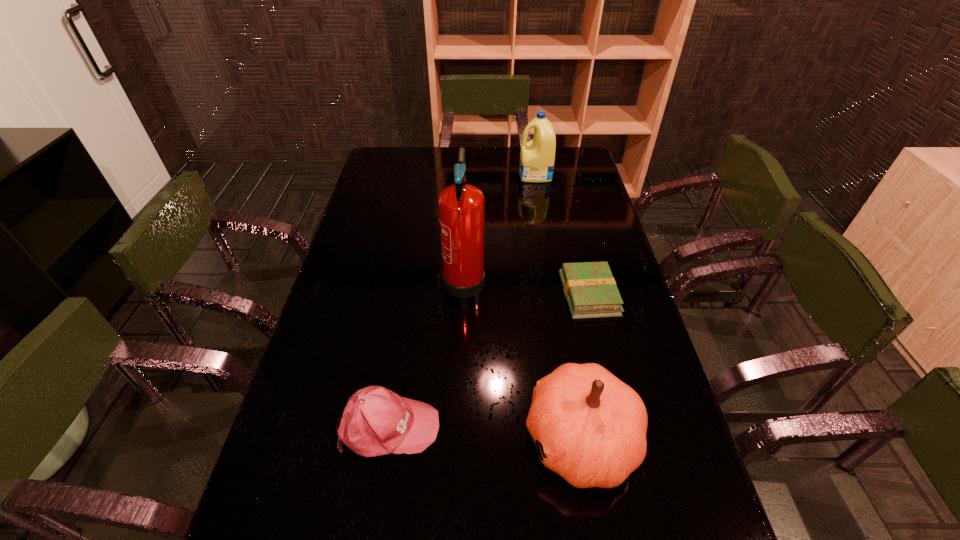
Where is `vacant space at the right edge of the desktop`? This screenshot has width=960, height=540. vacant space at the right edge of the desktop is located at coordinates pyautogui.click(x=605, y=235).

The image size is (960, 540). I want to click on free location at the far left corner of the desktop, so click(382, 151).

Identify the location of vacant space at the far right corner. (558, 160).

You are a GUI agent. You are given a task and a screenshot of the screen. Output one action in this format:
    pyautogui.click(x=<x>, y=<y>)
    Task: Click on the vacant space that is in between the shortest object and the fire extinguisher
    This screenshot has width=960, height=540.
    Given the screenshot: What is the action you would take?
    pyautogui.click(x=526, y=285)

I want to click on vacant point located between the baseball cap and the detergent, so click(x=462, y=300).

Where is `free space between the baseball cap and the detergent`? This screenshot has height=540, width=960. free space between the baseball cap and the detergent is located at coordinates (462, 300).

I want to click on vacant space in between the tallest object and the farthest object, so click(500, 225).

The height and width of the screenshot is (540, 960). In order to click on vacant space in between the shortest object and the farthest object in this screenshot , I will do `click(562, 234)`.

Where is `vacant region between the pumpkin and the detergent`? Image resolution: width=960 pixels, height=540 pixels. vacant region between the pumpkin and the detergent is located at coordinates (558, 307).

The width and height of the screenshot is (960, 540). I want to click on free spot between the pumpkin and the detergent, so click(558, 307).